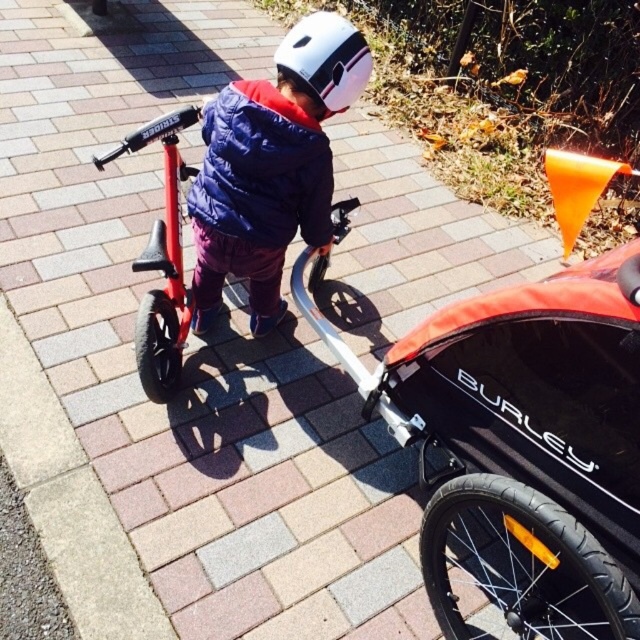
Question: Which object appears farthest from the camera in this image?

Choices:
 (A) shiny red bicycle at center
 (B) orange fabric baby carriage at center
 (C) blue down jacket at center
 (D) matte blue jacket at center

Answer: (C)

Question: Is orange fabric baby carriage at center positioned before matte blue jacket at center?

Choices:
 (A) no
 (B) yes

Answer: (B)

Question: Which object is farther from the camera taking this photo?

Choices:
 (A) white matte helmet at upper center
 (B) matte blue jacket at center
 (C) blue down jacket at center

Answer: (A)

Question: Can you confirm if matte blue jacket at center is smaller than shiny red bicycle at center?

Choices:
 (A) no
 (B) yes

Answer: (A)

Question: Does orange fabric baby carriage at center appear on the left side of shiny red bicycle at center?

Choices:
 (A) no
 (B) yes

Answer: (A)

Question: Which of the following is the closest to the observer?

Choices:
 (A) matte blue jacket at center
 (B) white matte helmet at upper center

Answer: (A)